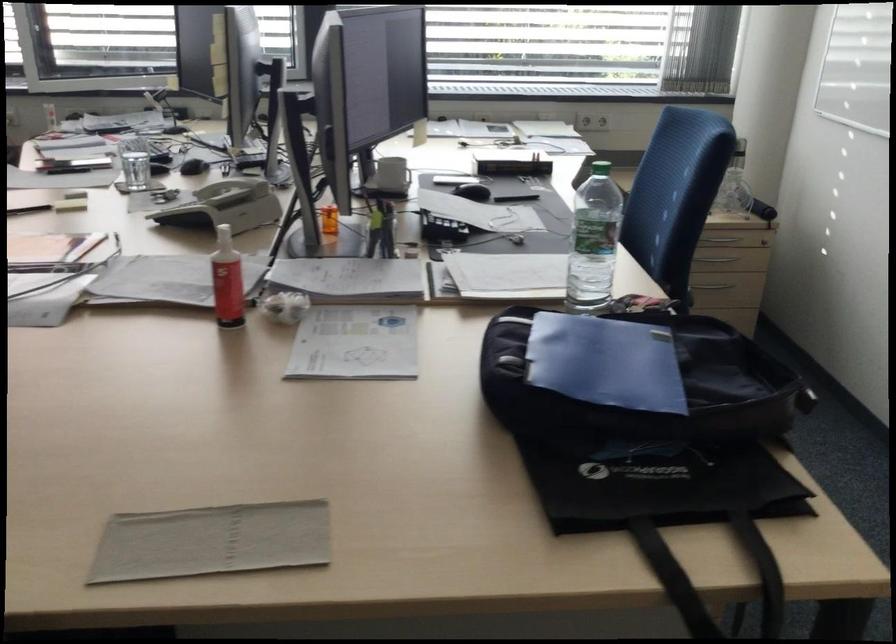
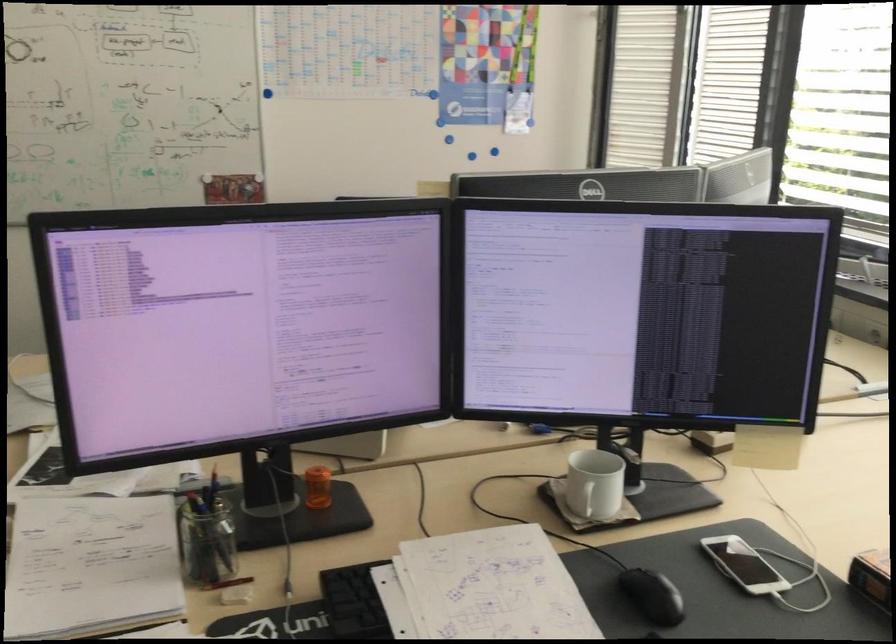
Where in the second image is the point corresponding to (418,249) from the first image?

(234, 596)